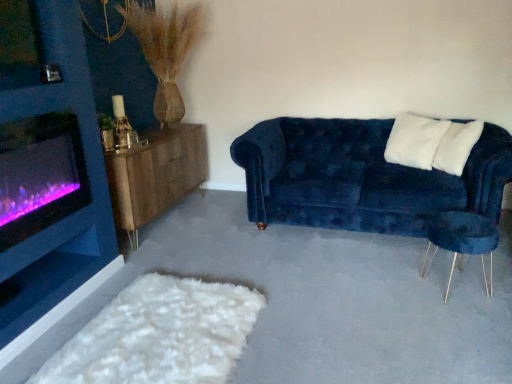
The height and width of the screenshot is (384, 512). I want to click on vacant space behind velvet blue armchair at right, so click(x=418, y=254).